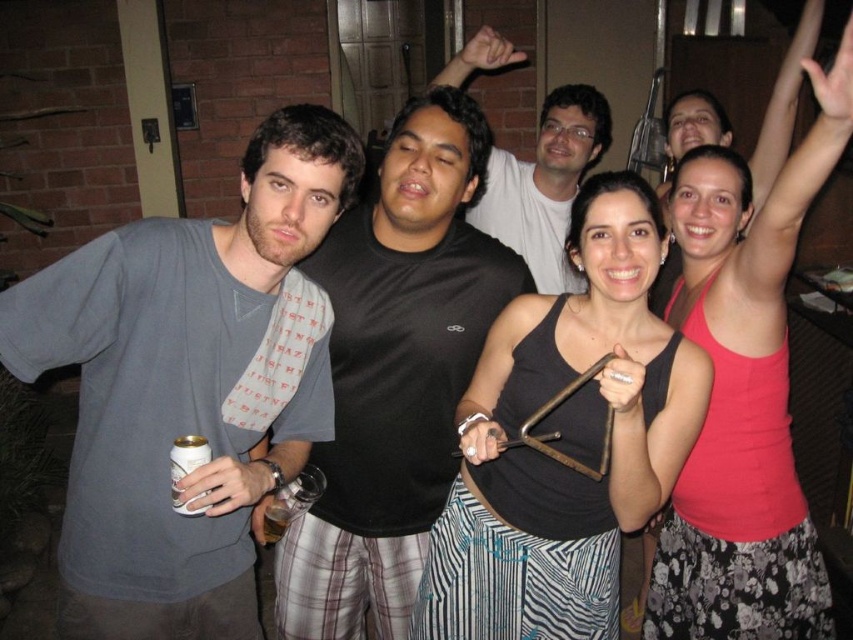
Question: Which of the following is the closest to the observer?

Choices:
 (A) tap(810, 193)
 (B) tap(613, 481)
 (C) tap(444, 348)
 (D) tap(277, 532)

Answer: (A)

Question: Does gray cotton t-shirt at left have a greater width compared to silver metallic can at lower left?

Choices:
 (A) yes
 (B) no

Answer: (A)

Question: Is black matte tank top at center bigger than black matte shirt at center?

Choices:
 (A) yes
 (B) no

Answer: (A)

Question: Based on their relative distances, which object is nearer to the pink fabric tank top at upper right?

Choices:
 (A) silver metallic can at lower left
 (B) translucent glass beer at lower center
 (C) black matte shirt at center
 (D) black matte t-shirt at center

Answer: (D)

Question: Is the position of gray cotton t-shirt at left more distant than that of translucent glass beer at lower center?

Choices:
 (A) no
 (B) yes

Answer: (A)

Question: Which point is closer to the camera taking this photo?

Choices:
 (A) (389, 244)
 (B) (148, 637)
 (C) (526, 241)

Answer: (B)